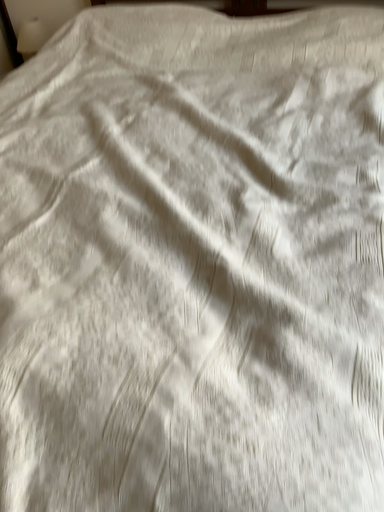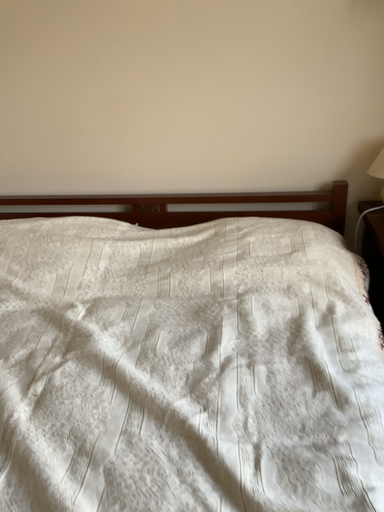
Question: Which way did the camera rotate in the video?

Choices:
 (A) rotated left
 (B) rotated right

Answer: (B)